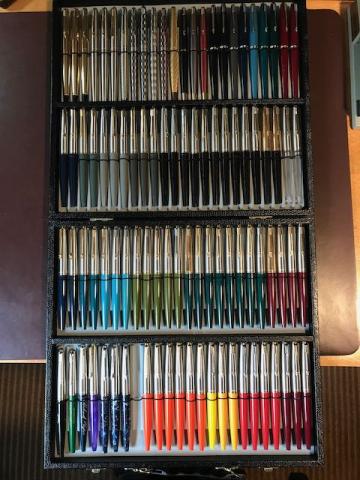
This screenshot has height=480, width=360. In order to click on place to sit in this screenshot , I will do `click(335, 259)`.